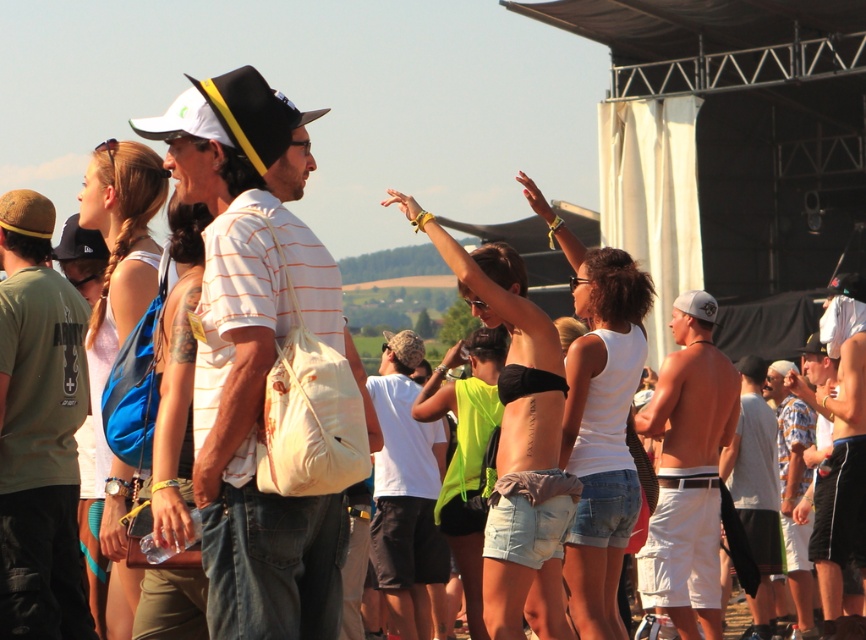
Question: Is green cotton t-shirt at left thinner than white cotton t-shirt at center?

Choices:
 (A) no
 (B) yes

Answer: (A)

Question: Which of these objects is positioned closest to the white cotton shorts at right?

Choices:
 (A) white cotton t-shirt at center
 (B) green cotton t-shirt at left
 (C) white canvas bag at center

Answer: (A)

Question: Does white canvas bag at center have a greater width compared to green cotton t-shirt at left?

Choices:
 (A) yes
 (B) no

Answer: (A)

Question: Which of the following is the closest to the observer?

Choices:
 (A) (696, 339)
 (B) (204, 93)
 (C) (417, 492)
 (D) (18, 300)

Answer: (B)

Question: Which object is the closest to the shiny silver tank top at center?

Choices:
 (A) white cotton t-shirt at center
 (B) green cotton t-shirt at left
 (C) white canvas bag at center
 (D) white cotton shorts at right

Answer: (D)

Question: Does white cotton shorts at right have a lesser width compared to white cotton t-shirt at center?

Choices:
 (A) yes
 (B) no

Answer: (B)